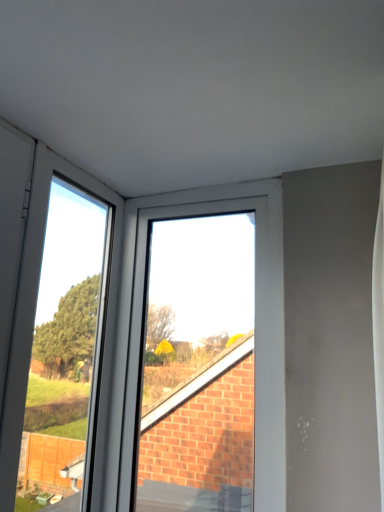
Question: From the image's perspective, is white plastic window at upper center positioned above or below transparent glass door at left?

Choices:
 (A) below
 (B) above

Answer: (A)

Question: From a real-world perspective, relative to transparent glass door at left, is white plastic window at upper center vertically above or below?

Choices:
 (A) above
 (B) below

Answer: (A)

Question: Is white plastic window at upper center wider or thinner than transparent glass door at left?

Choices:
 (A) wide
 (B) thin

Answer: (A)

Question: Which is correct: transparent glass door at left is inside white plastic window at upper center, or outside of it?

Choices:
 (A) outside
 (B) inside

Answer: (A)

Question: From the image's perspective, relative to white plastic window at upper center, is transparent glass door at left above or below?

Choices:
 (A) above
 (B) below

Answer: (A)

Question: Looking at their shapes, would you say transparent glass door at left is wider or thinner than white plastic window at upper center?

Choices:
 (A) thin
 (B) wide

Answer: (A)

Question: Relative to white plastic window at upper center, is transparent glass door at left in front or behind?

Choices:
 (A) behind
 (B) front

Answer: (B)